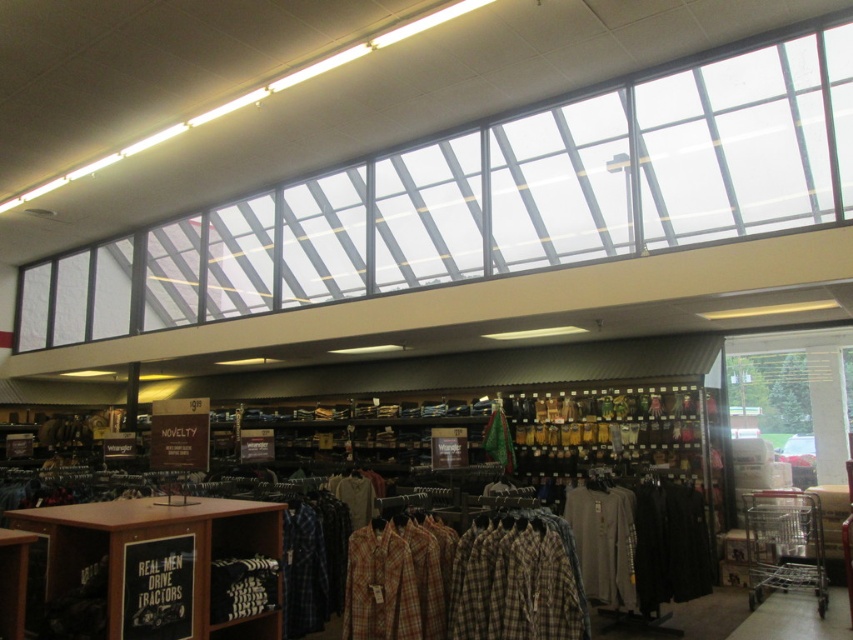
You are a customer in the men clothing store and you want to pick up the plaid cotton shirt at center. Which object is closer to you when you are standing in front of the wooden shelf at lower left?

The wooden shelf at lower left is closer to you since it is positioned on the left side of the plaid cotton shirt at center, meaning you are already standing near it.

You are a customer in the store and want to reach the plaid cotton shirt at center. The wooden shelf at lower left is blocking your path. Can you walk around it easily?

The wooden shelf at lower left is taller than the plaid cotton shirt at center, but since the shelf is a lower structure, you can likely walk around it to access the plaid cotton shirt at center without difficulty.